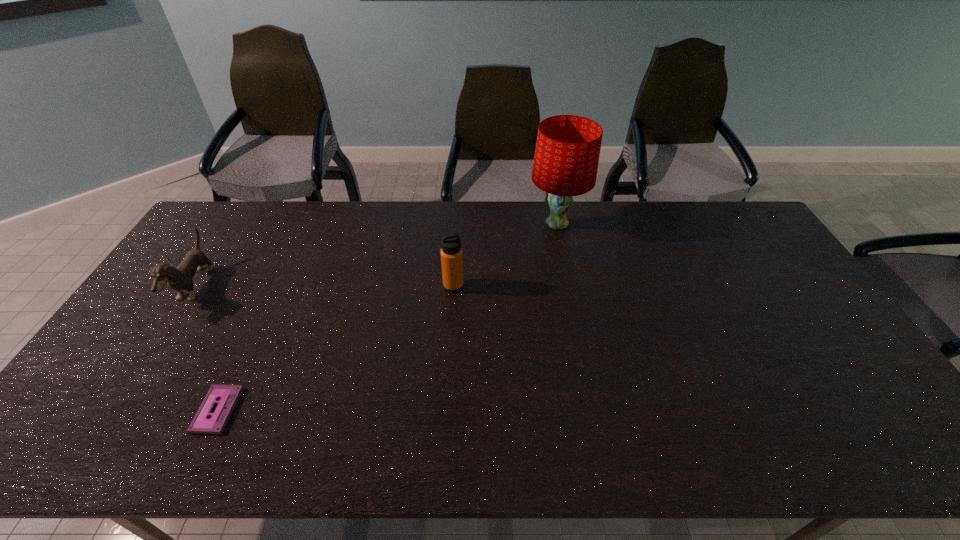
Locate an element on the screen. Image resolution: width=960 pixels, height=540 pixels. vacant space situated on the front-facing side of the lampshade is located at coordinates (483, 224).

Locate an element on the screen. The height and width of the screenshot is (540, 960). free space located on the right of the second tallest object is located at coordinates (573, 286).

At what (x,y) coordinates should I click in order to perform the action: click on free space located 0.180m at the face of the puppy. Please return your answer as a coordinate pair (x, y). This screenshot has width=960, height=540. Looking at the image, I should click on (263, 287).

This screenshot has height=540, width=960. In order to click on vacant region located 0.210m on the back of the nearest object in this screenshot , I will do `click(257, 323)`.

Where is `object that is positioned at the far edge`? This screenshot has width=960, height=540. object that is positioned at the far edge is located at coordinates (567, 151).

I want to click on object at the near edge, so click(228, 395).

Identify the location of object present at the left edge. Image resolution: width=960 pixels, height=540 pixels. (180, 278).

Identify the location of vacant space at the far edge. The image size is (960, 540). (412, 228).

Identify the location of free space at the near edge of the desktop. This screenshot has width=960, height=540. (392, 448).

At what (x,y) coordinates should I click in order to perform the action: click on free space at the left edge of the desktop. Please return your answer as a coordinate pair (x, y). The image size is (960, 540). Looking at the image, I should click on (181, 327).